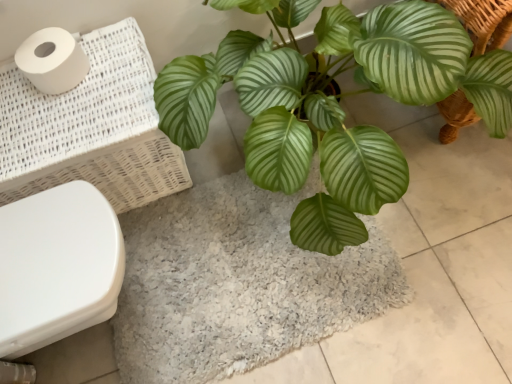
Image resolution: width=512 pixels, height=384 pixels. What do you see at coordinates (52, 60) in the screenshot? I see `white matte toilet paper at upper left` at bounding box center [52, 60].

This screenshot has width=512, height=384. Identify the location of gray shaggy bath mat at center. (237, 283).

Does point (197, 189) lie in front of point (335, 162)?

No, it is behind (335, 162).

Considering the relative positions of gray shaggy bath mat at center and green glossy leafy plant at center in the image provided, is gray shaggy bath mat at center to the left of green glossy leafy plant at center from the viewer's perspective?

Yes.

From the image's perspective, relative to green glossy leafy plant at center, is gray shaggy bath mat at center above or below?

gray shaggy bath mat at center is below green glossy leafy plant at center.

Is gray shaggy bath mat at center spatially inside green glossy leafy plant at center, or outside of it?

gray shaggy bath mat at center is not enclosed by green glossy leafy plant at center.

Is point (78, 65) closer or farther from the camera than point (207, 89)?

Point (78, 65) is positioned farther from the camera compared to point (207, 89).

From a real-world perspective, is white matte toilet paper at upper left beneath green glossy leafy plant at center?

Incorrect, from a real-world perspective, white matte toilet paper at upper left is higher than green glossy leafy plant at center.

The height and width of the screenshot is (384, 512). In order to click on toilet paper behind the green glossy leafy plant at center in this screenshot , I will do `click(52, 60)`.

From the image's perspective, which one is positioned higher, white woven laundry basket at left or gray shaggy bath mat at center?

white woven laundry basket at left, from the image's perspective.

Based on the photo, is white woven laundry basket at left to the right of gray shaggy bath mat at center from the viewer's perspective?

No.

Does point (144, 181) appear closer or farther from the camera than point (127, 329)?

Clearly, point (144, 181) is more distant from the camera than point (127, 329).

Is white woven laundry basket at left looking in the opposite direction of gray shaggy bath mat at center?

No, white woven laundry basket at left's orientation is not away from gray shaggy bath mat at center.

Would you say white matte toilet paper at upper left is part of white woven laundry basket at left's contents?

Yes, white matte toilet paper at upper left can be found within white woven laundry basket at left.

From a real-world perspective, who is located lower, white woven laundry basket at left or white matte toilet paper at upper left?

In real-world perspective, white woven laundry basket at left is lower.

How much distance is there between white woven laundry basket at left and white matte toilet paper at upper left?

18.26 centimeters.

From their relative heights in the image, would you say white woven laundry basket at left is taller or shorter than white matte toilet paper at upper left?

Considering their sizes, white woven laundry basket at left has more height than white matte toilet paper at upper left.

Which point is more distant from viewer, (54, 45) or (5, 138)?

The point (54, 45) is farther from the camera.

How distant is white matte toilet paper at upper left from white woven laundry basket at left?

The distance of white matte toilet paper at upper left from white woven laundry basket at left is 7.19 inches.

I want to click on toilet paper on the right of white woven laundry basket at left, so click(x=52, y=60).

Which object is positioned more to the left, white matte toilet paper at upper left or white woven laundry basket at left?

From the viewer's perspective, white woven laundry basket at left appears more on the left side.

This screenshot has height=384, width=512. What are the coordinates of `toilet paper on the left of white glossy toilet bowl at lower left` in the screenshot? It's located at (52, 60).

Visually, is white glossy toilet bowl at lower left positioned to the left or to the right of white matte toilet paper at upper left?

In the image, white glossy toilet bowl at lower left appears on the right side of white matte toilet paper at upper left.

Relative to white matte toilet paper at upper left, is white glossy toilet bowl at lower left in front or behind?

white glossy toilet bowl at lower left is in front of white matte toilet paper at upper left.

Does white woven laundry basket at left have a lesser width compared to green glossy leafy plant at center?

Yes.

Are white woven laundry basket at left and green glossy leafy plant at center beside each other?

No, white woven laundry basket at left is not with green glossy leafy plant at center.

How many degrees apart are the facing directions of white woven laundry basket at left and green glossy leafy plant at center?

The facing directions of white woven laundry basket at left and green glossy leafy plant at center are 0.236 degrees apart.

Can green glossy leafy plant at center be found inside white woven laundry basket at left?

No.

At what (x,y) coordinates should I click in order to perform the action: click on houseplant lying on the right of gray shaggy bath mat at center. Please return your answer as a coordinate pair (x, y). Image resolution: width=512 pixels, height=384 pixels. Looking at the image, I should click on (332, 103).

Find the location of `toilet paper located above the green glossy leafy plant at center (from a real-world perspective)`. toilet paper located above the green glossy leafy plant at center (from a real-world perspective) is located at coordinates (52, 60).

Looking at the image, which one is located further to white matte toilet paper at upper left, green glossy leafy plant at center or gray shaggy bath mat at center?

The object further to white matte toilet paper at upper left is gray shaggy bath mat at center.

When comparing their distances from white glossy toilet bowl at lower left, does gray shaggy bath mat at center or white matte toilet paper at upper left seem further?

white matte toilet paper at upper left is further to white glossy toilet bowl at lower left.

Looking at the image, which one is located closer to white glossy toilet bowl at lower left, white matte toilet paper at upper left or green glossy leafy plant at center?

white matte toilet paper at upper left.

Which object lies nearer to the anchor point white woven laundry basket at left, white glossy toilet bowl at lower left or gray shaggy bath mat at center?

white glossy toilet bowl at lower left lies closer to white woven laundry basket at left than the other object.

When comparing their distances from white glossy toilet bowl at lower left, does green glossy leafy plant at center or gray shaggy bath mat at center seem further?

green glossy leafy plant at center is further to white glossy toilet bowl at lower left.

Consider the image. Estimate the real-world distances between objects in this image. Which object is further from green glossy leafy plant at center, white matte toilet paper at upper left or white glossy toilet bowl at lower left?

white matte toilet paper at upper left lies further to green glossy leafy plant at center than the other object.

Based on their spatial positions, is white glossy toilet bowl at lower left or white matte toilet paper at upper left closer to green glossy leafy plant at center?

white glossy toilet bowl at lower left is positioned closer to the anchor green glossy leafy plant at center.

From the image, which object appears to be nearer to green glossy leafy plant at center, gray shaggy bath mat at center or white matte toilet paper at upper left?

gray shaggy bath mat at center.

Identify the location of toilet bowl located between white woven laundry basket at left and green glossy leafy plant at center in the left-right direction. (57, 266).

The height and width of the screenshot is (384, 512). I want to click on toilet paper located between white woven laundry basket at left and gray shaggy bath mat at center in the left-right direction, so click(52, 60).

Find the location of `toilet bowl between white woven laundry basket at left and gray shaggy bath mat at center`. toilet bowl between white woven laundry basket at left and gray shaggy bath mat at center is located at coordinates (57, 266).

The height and width of the screenshot is (384, 512). Find the location of `bath mat between white matte toilet paper at upper left and white glossy toilet bowl at lower left vertically`. bath mat between white matte toilet paper at upper left and white glossy toilet bowl at lower left vertically is located at coordinates (237, 283).